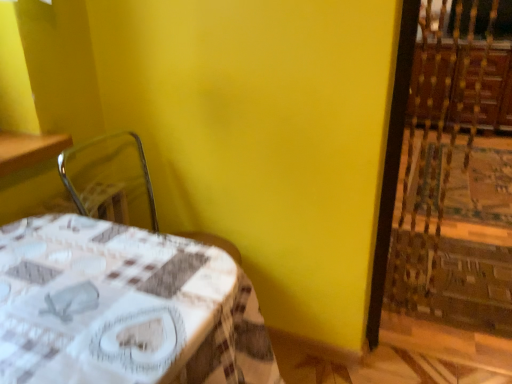
At what (x,y) coordinates should I click in order to perform the action: click on white printed fabric table at lower left. Please return your answer as a coordinate pair (x, y). Looking at the image, I should click on (124, 307).

Describe the element at coordinates (124, 307) in the screenshot. This screenshot has height=384, width=512. I see `white printed fabric table at lower left` at that location.

The height and width of the screenshot is (384, 512). I want to click on white printed fabric table at lower left, so pyautogui.click(x=124, y=307).